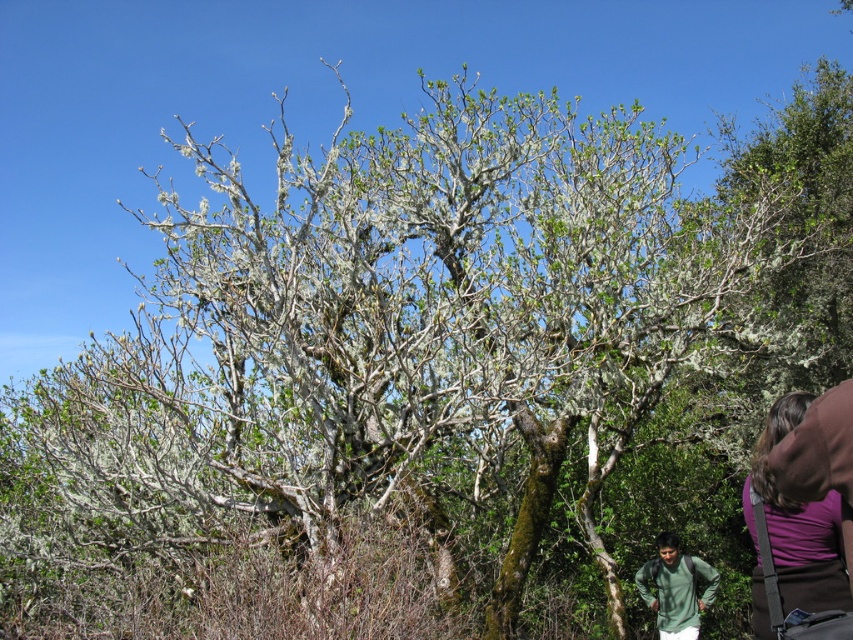
Question: Is purple fabric at lower right to the right of green matte shirt at lower right from the viewer's perspective?

Choices:
 (A) no
 (B) yes

Answer: (A)

Question: Which point is closer to the camera?

Choices:
 (A) green matte shirt at lower right
 (B) purple fabric at lower right

Answer: (B)

Question: Is purple fabric at lower right in front of green matte shirt at lower right?

Choices:
 (A) yes
 (B) no

Answer: (A)

Question: Among these points, which one is nearest to the camera?

Choices:
 (A) (770, 536)
 (B) (711, 595)

Answer: (A)

Question: Can you confirm if purple fabric at lower right is positioned to the right of green matte shirt at lower right?

Choices:
 (A) no
 (B) yes

Answer: (A)